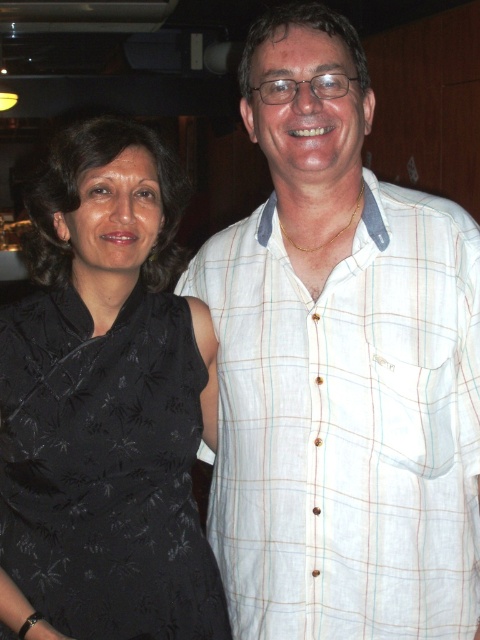
Can you confirm if white plaid shirt at right is taller than black satin dress at left?

Yes, white plaid shirt at right is taller than black satin dress at left.

Does point (476, 540) lie behind point (20, 364)?

Yes.

The height and width of the screenshot is (640, 480). In order to click on white plaid shirt at right in this screenshot , I will do click(348, 426).